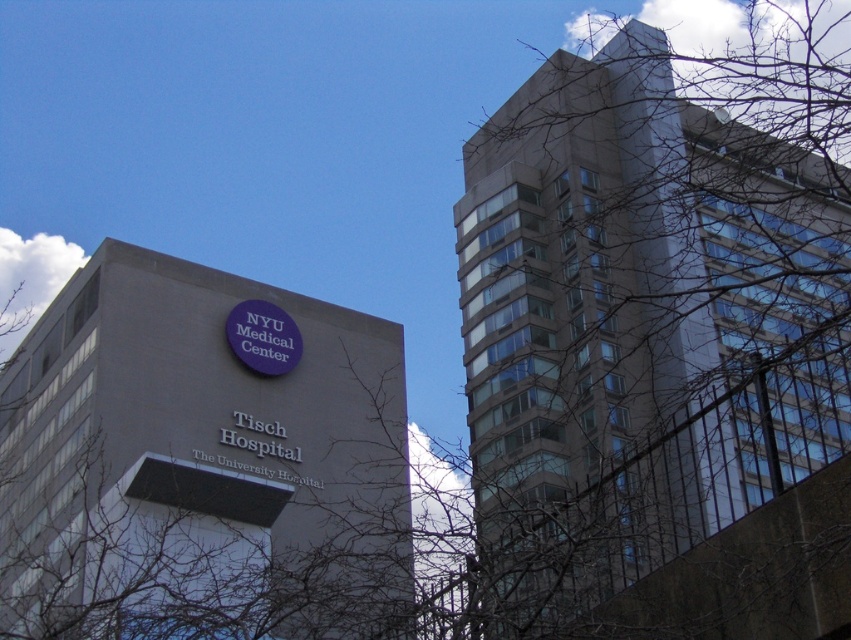
Based on the scene, which object is wider, the gray concrete building at center or the purple matte sign at center?

The gray concrete building at center is wider than the purple matte sign at center according to the description.

You are standing in the middle of the street looking at the gray concrete building at center and the purple matte sign at center. How far apart are these two landmarks from each other?

The gray concrete building at center is 19.04 meters away from the purple matte sign at center.

You are a bird flying over the city and want to land on the highest point between the bare branches at upper left and the purple matte sign at center. Which one should you choose?

The bare branches at upper left is much taller as purple matte sign at center, so you should choose the bare branches at upper left to land on.